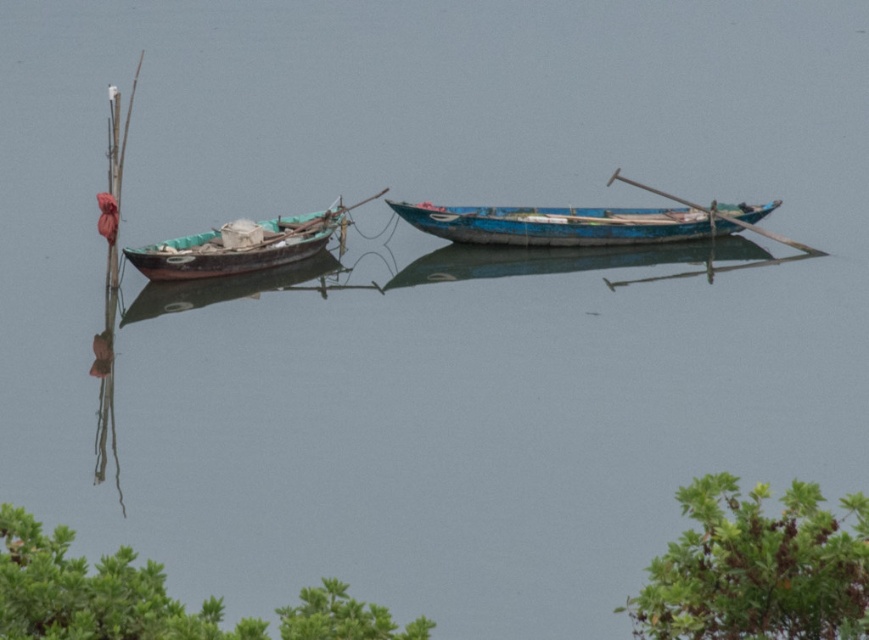
Question: Estimate the real-world distances between objects in this image. Which object is closer to the blue wooden boat at center?

Choices:
 (A) wooden boat at left
 (B) green leafy tree at lower left

Answer: (A)

Question: Considering the real-world distances, which object is farthest from the green leafy tree at lower left?

Choices:
 (A) wooden boat at left
 (B) blue wooden boat at center
 (C) green leafy tree at lower right

Answer: (B)

Question: Is green leafy tree at lower right above green leafy tree at lower left?

Choices:
 (A) no
 (B) yes

Answer: (B)

Question: Is green leafy tree at lower right behind wooden boat at left?

Choices:
 (A) no
 (B) yes

Answer: (A)

Question: Considering the relative positions of green leafy tree at lower right and wooden boat at left in the image provided, where is green leafy tree at lower right located with respect to wooden boat at left?

Choices:
 (A) left
 (B) right

Answer: (B)

Question: Which object is the farthest from the green leafy tree at lower right?

Choices:
 (A) green leafy tree at lower left
 (B) blue wooden boat at center
 (C) wooden boat at left

Answer: (B)